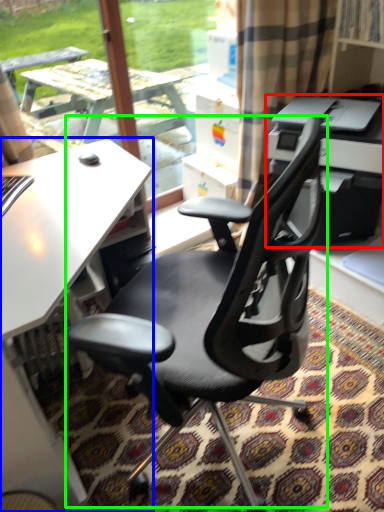
Question: Which object is the closest to the printer (highlighted by a red box)? Choose among these: desk (highlighted by a blue box) or chair (highlighted by a green box).

Choices:
 (A) desk
 (B) chair

Answer: (B)